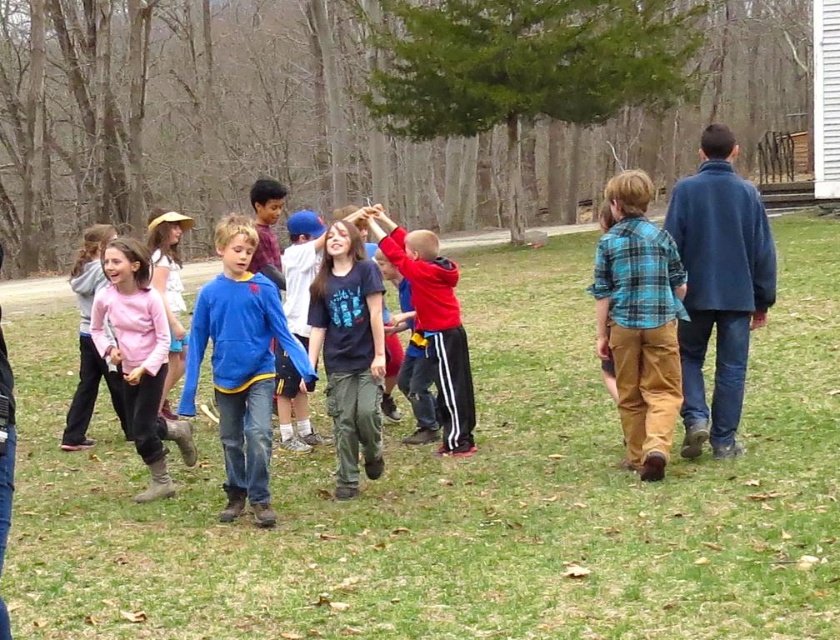
You are a photographer trying to capture a shot of the blue plaid shirt at center and the blue fleece jacket at center. Which one is positioned higher in the frame?

The blue plaid shirt at center is located above the blue fleece jacket at center, so it is positioned higher in the frame.

You are a photographer trying to capture a group photo of the children. You notice two children wearing the blue plaid shirt at center and the red fleece jacket at center. Which child should you ask to step back so that both can be clearly visible in the photo?

You should ask the child wearing the blue plaid shirt at center to step back because it is bigger than the red fleece jacket at center, allowing more space for both to be visible.

You are a photographer trying to capture a photo of the children. You notice two children wearing the blue plaid shirt at center and the red fleece jacket at center. Which child should you focus on if you want to ensure the subject is closer to the camera?

The blue plaid shirt at center is in front of the red fleece jacket at center, so focusing on the blue plaid shirt at center will ensure the subject is closer to the camera.